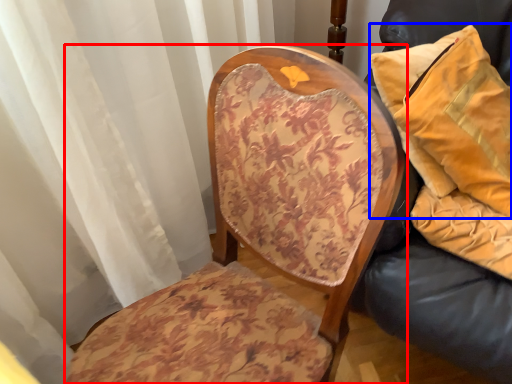
Question: Which point is further to the camera, chair (highlighted by a red box) or pillow (highlighted by a blue box)?

Choices:
 (A) chair
 (B) pillow

Answer: (B)